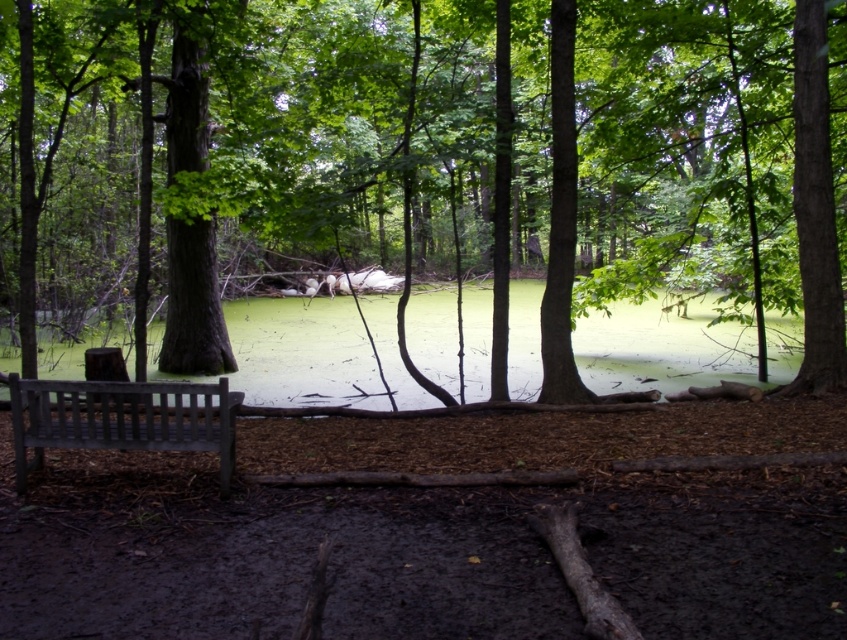
Between point (270, 80) and point (582, 360), which one is positioned in front?

Positioned in front is point (270, 80).

Is brown wood tree at center to the left of green algae water at center from the viewer's perspective?

Yes, brown wood tree at center is to the left of green algae water at center.

Identify the location of brown wood tree at center. (692, 172).

Locate an element on the screen. brown wood tree at center is located at coordinates (692, 172).

Between brown wood tree at center and wooden bench at left, which one appears on the left side from the viewer's perspective?

Positioned to the left is wooden bench at left.

Is brown wood tree at center positioned at the back of wooden bench at left?

That is True.

Does point (573, 51) lie behind point (170, 438)?

Yes, it is behind point (170, 438).

Find the location of a particular element. The height and width of the screenshot is (640, 847). brown wood tree at center is located at coordinates coord(692,172).

Is green algae water at center bigger than wooden bench at left?

Yes.

Does point (79, 355) lie in front of point (18, 452)?

That is False.

Find the location of a particular element. This screenshot has height=640, width=847. green algae water at center is located at coordinates (302, 353).